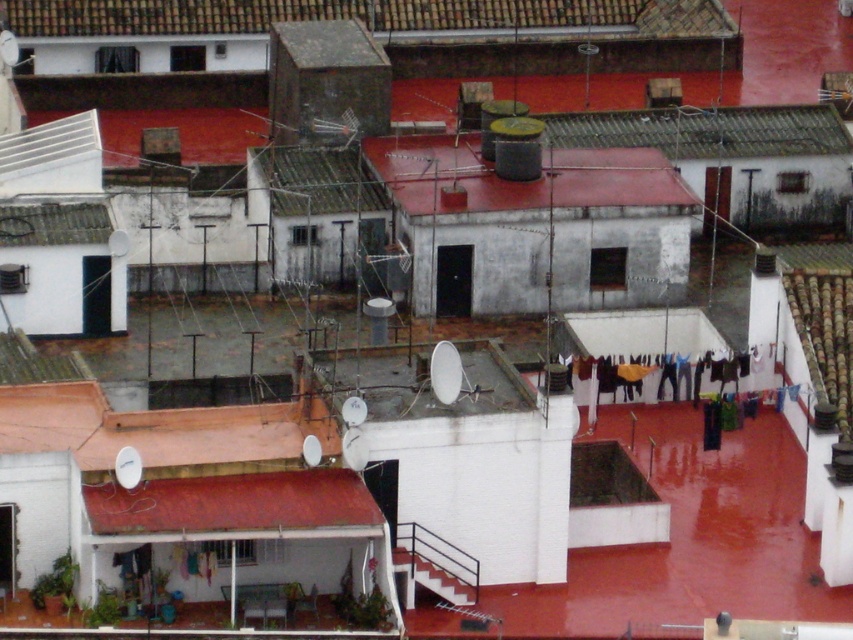
You are standing on the rooftop and want to walk from the point at coordinates point (640, 188) to the point at coordinates point (680, 134). Which direction should you move relative to your current position?

You should move backward because point (640, 188) is in front of point (680, 134), meaning the destination is behind your current position.

Based on the photo, you are a window cleaner with a ladder that can reach up to 3 meters. You need to clean both the red matte roof at center and the smooth red awning at center. Based on their heights, which one can you reach with your ladder?

The red matte roof at center is shorter than the smooth red awning at center, so the window cleaner can reach the red matte roof at center with the ladder since it is lower than the awning.